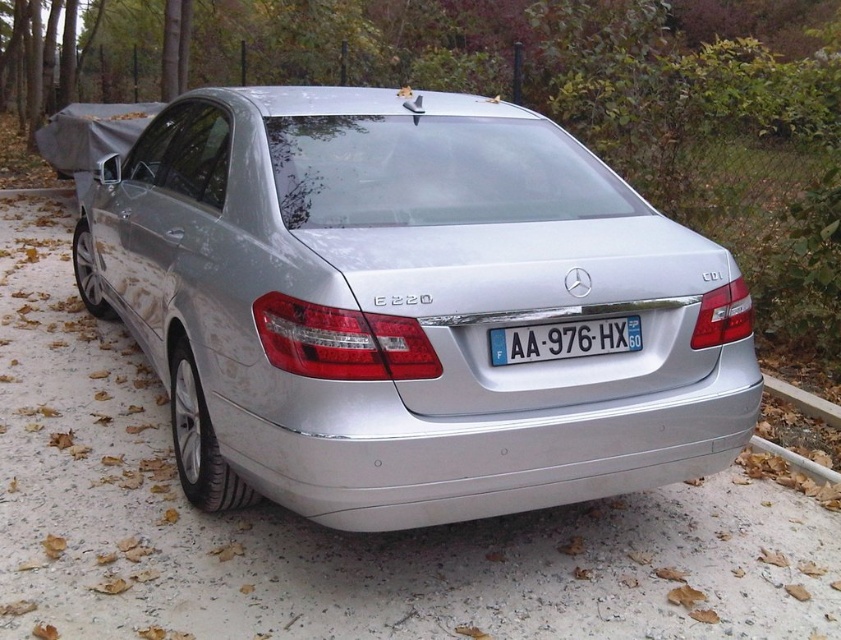
Is white plastic license plate at center positioned at the back of white plastic pipe at lower right?

No.

Which of these two, white plastic license plate at center or white plastic pipe at lower right, stands shorter?

With less height is white plastic pipe at lower right.

Is point (527, 360) positioned after point (764, 449)?

That is False.

At what (x,y) coordinates should I click in order to perform the action: click on white plastic license plate at center. Please return your answer as a coordinate pair (x, y). The height and width of the screenshot is (640, 841). Looking at the image, I should click on (563, 340).

Does silver metallic car at center have a lesser height compared to white plastic license plate at center?

No, silver metallic car at center is not shorter than white plastic license plate at center.

What do you see at coordinates (408, 307) in the screenshot? The width and height of the screenshot is (841, 640). I see `silver metallic car at center` at bounding box center [408, 307].

Who is more distant from viewer, (202, 307) or (498, 365)?

The point (202, 307) is more distant.

You are a GUI agent. You are given a task and a screenshot of the screen. Output one action in this format:
    pyautogui.click(x=<x>, y=<y>)
    Task: Click on the silver metallic car at center
    The image size is (841, 640).
    Given the screenshot: What is the action you would take?
    pyautogui.click(x=408, y=307)

Is gray concrete curb at lower right positioned before white plastic pipe at lower right?

No, it is behind white plastic pipe at lower right.

Which is behind, point (807, 412) or point (808, 461)?

Point (807, 412)

The height and width of the screenshot is (640, 841). Find the location of `gray concrete curb at lower right`. gray concrete curb at lower right is located at coordinates (802, 401).

The height and width of the screenshot is (640, 841). Identify the location of gray concrete curb at lower right. (802, 401).